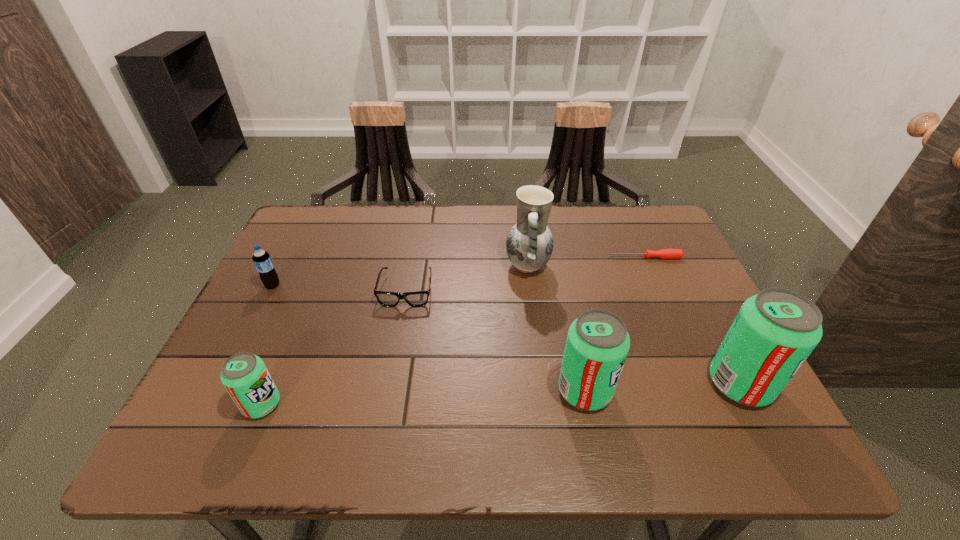
This screenshot has width=960, height=540. I want to click on free space between the second soda bottle from left to right and the pottery, so click(395, 335).

This screenshot has height=540, width=960. I want to click on the second closest object to the rightmost soda bottle, so click(664, 253).

Choose which object is the nearest neighbor to the fifth object from right to left. Please provide its 2D coordinates. Your answer should be formatted as a tuple, i.e. [(x, y)], where the tuple contains the x and y coordinates of a point satisfying the conditions above.

[(529, 245)]

The width and height of the screenshot is (960, 540). In order to click on soda bottle that can be found as the third closest to the farthest soda bottle in this screenshot , I will do `click(774, 332)`.

Locate which soda bottle ranks second in proximity to the third soda bottle from right to left. Please provide its 2D coordinates. Your answer should be formatted as a tuple, i.e. [(x, y)], where the tuple contains the x and y coordinates of a point satisfying the conditions above.

[(597, 344)]

This screenshot has height=540, width=960. I want to click on free location that satisfies the following two spatial constraints: 1. on either side of the pottery; 2. on the front-facing side of the second shortest object, so click(x=531, y=290).

The width and height of the screenshot is (960, 540). I want to click on free spot that satisfies the following two spatial constraints: 1. at the tip of the shortest object; 2. on the front-facing side of the sunglasses, so click(660, 290).

Identify the location of free space that satisfies the following two spatial constraints: 1. on the front-facing side of the sunglasses; 2. on the front-facing side of the second object from left to right. The image size is (960, 540). (386, 404).